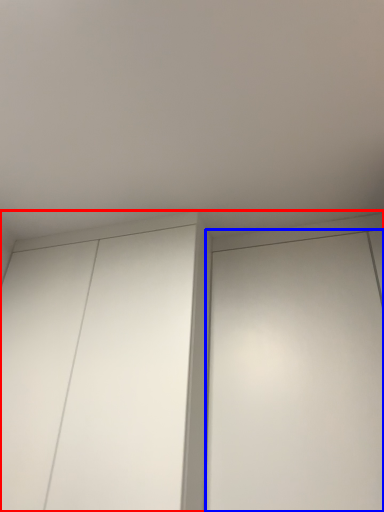
Question: Which point is closer to the camera, cupboard (highlighted by a red box) or elevator (highlighted by a blue box)?

Choices:
 (A) cupboard
 (B) elevator

Answer: (B)